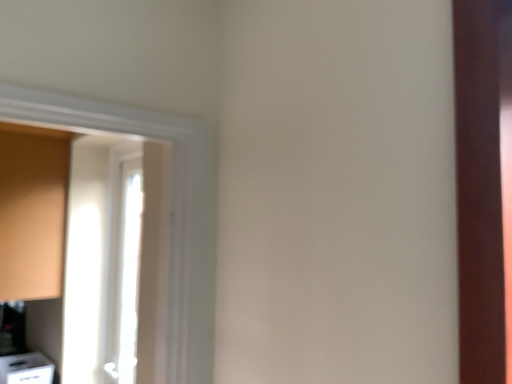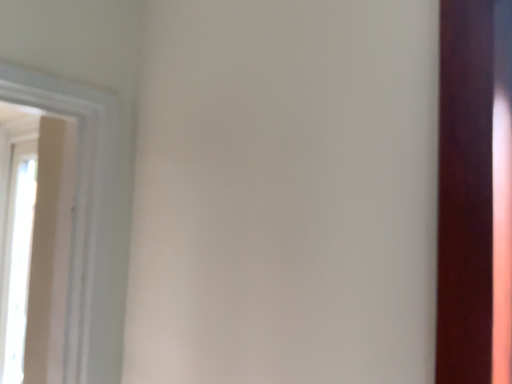
Question: Which way did the camera rotate in the video?

Choices:
 (A) rotated right
 (B) rotated left

Answer: (A)